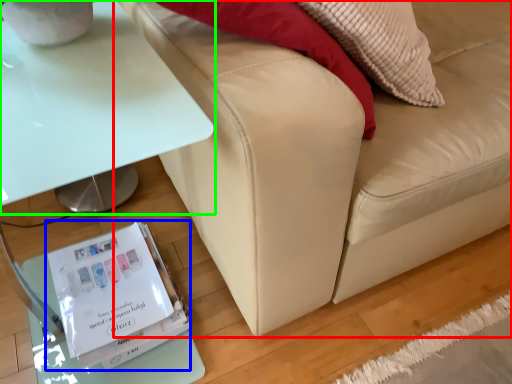
Question: Based on their relative distances, which object is nearer to studio couch (highlighted by a red box)? Choose from paperback book (highlighted by a blue box) and table (highlighted by a green box).

Choices:
 (A) paperback book
 (B) table

Answer: (B)